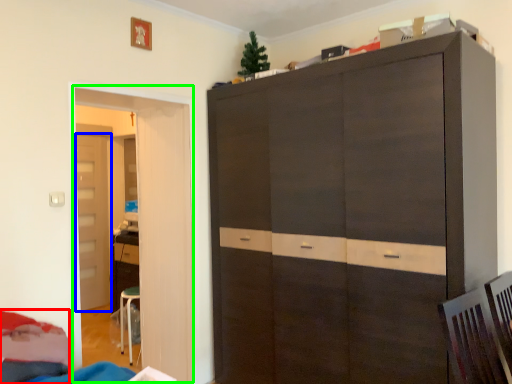
Question: Estimate the real-world distances between objects in this image. Which object is closer to bed (highlighted by a red box), door (highlighted by a blue box) or door (highlighted by a green box)?

Choices:
 (A) door
 (B) door

Answer: (B)